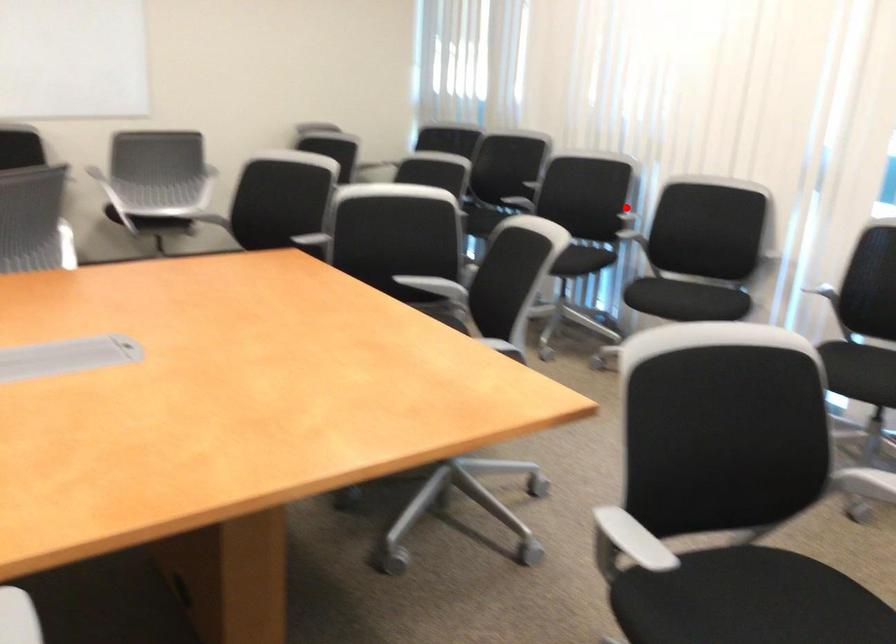
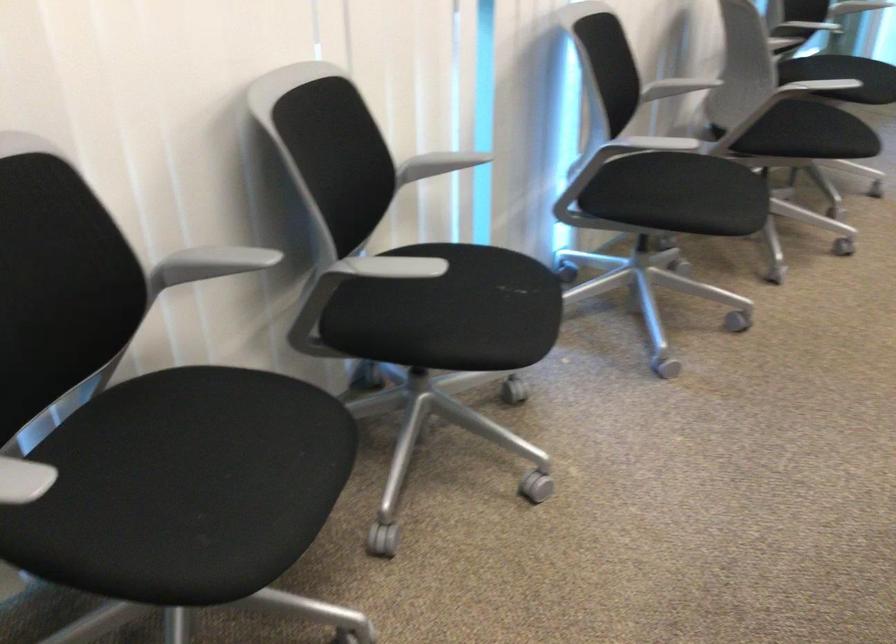
Where in the second image is the point corresponding to the highlighted location from the first image?

(211, 263)